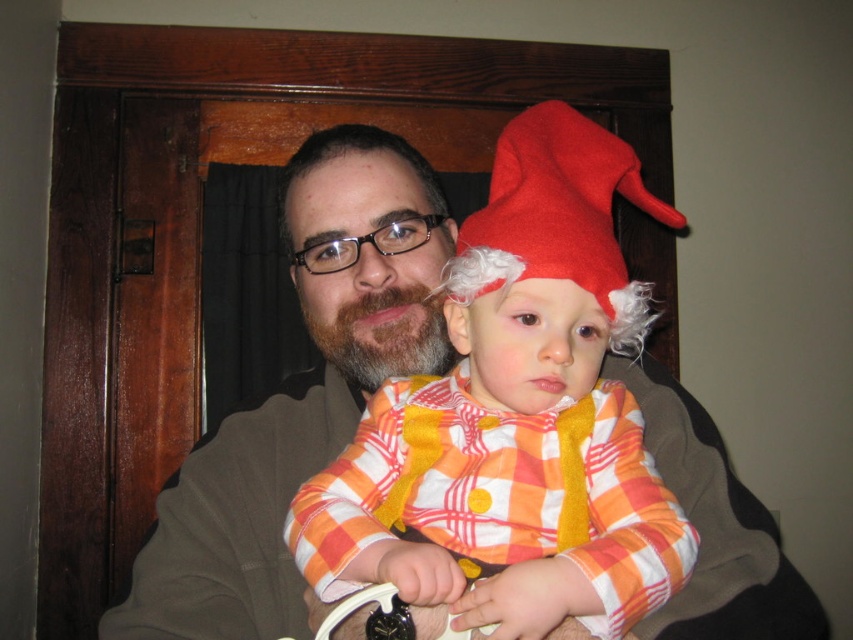
You are a photographer setting up a photo shoot in the described scene. You need to ensure that the matte brown jacket at center and the felt red hat at center are both visible in the frame. Given their sizes, which object should you focus on to ensure both are in the frame without cropping?

The matte brown jacket at center is taller than the felt red hat at center, so focusing on the matte brown jacket at center will ensure both objects are within the frame without cropping.

You are taking a photo of two people in a room. There are two points marked in the image at coordinates point (335, 339) and point (584, 237). If you want to focus on the closer point to ensure the subject is sharp, which coordinate should you choose?

You should focus on point (335, 339) because it is closer to the camera than point (584, 237), ensuring the subject at that point will be in focus.

You are an interior designer assessing the placement of the matte brown jacket at center in a room. Based on the coordinates provided in the description, can you determine if the jacket is positioned closer to the door frame or the opposite wall?

The coordinates of the matte brown jacket at center are at point (299, 394). Since the coordinate system typically places the origin at the bottom left corner, a higher x value indicates a position closer to the right side of the image. Therefore, the jacket is closer to the door frame on the right side of the room.